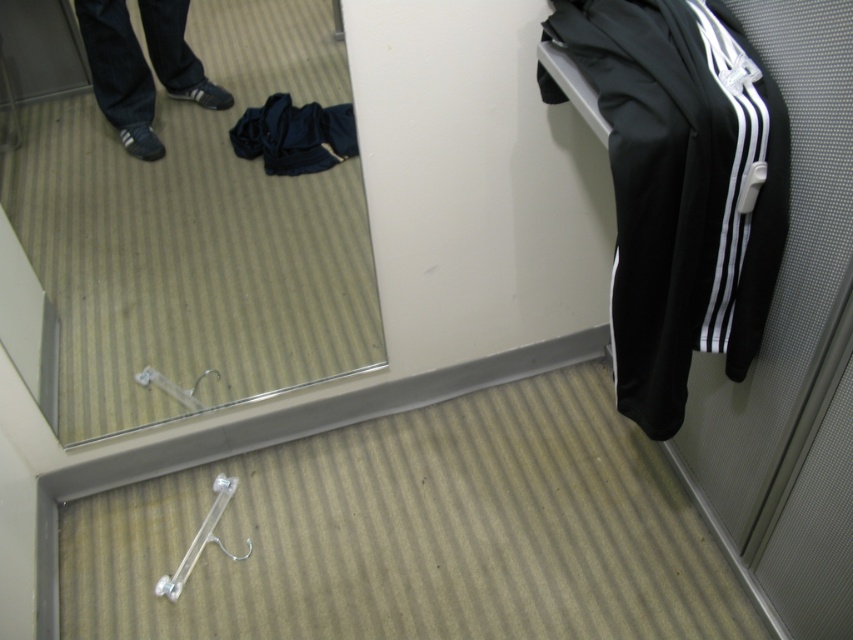
Question: Among these points, which one is farthest from the camera?

Choices:
 (A) (541, 67)
 (B) (268, 132)

Answer: (B)

Question: Can you confirm if dark blue jeans at lower left is smaller than dark blue fabric at center?

Choices:
 (A) yes
 (B) no

Answer: (B)

Question: Is black fabric tracksuit at right to the left of dark blue fabric at center from the viewer's perspective?

Choices:
 (A) no
 (B) yes

Answer: (A)

Question: Is dark blue jeans at lower left to the left of dark blue fabric at center from the viewer's perspective?

Choices:
 (A) yes
 (B) no

Answer: (A)

Question: Which is nearer to the dark blue jeans at lower left?

Choices:
 (A) black fabric tracksuit at right
 (B) dark blue fabric at center

Answer: (B)

Question: Which is farther from the dark blue fabric at center?

Choices:
 (A) dark blue jeans at lower left
 (B) black fabric tracksuit at right

Answer: (B)